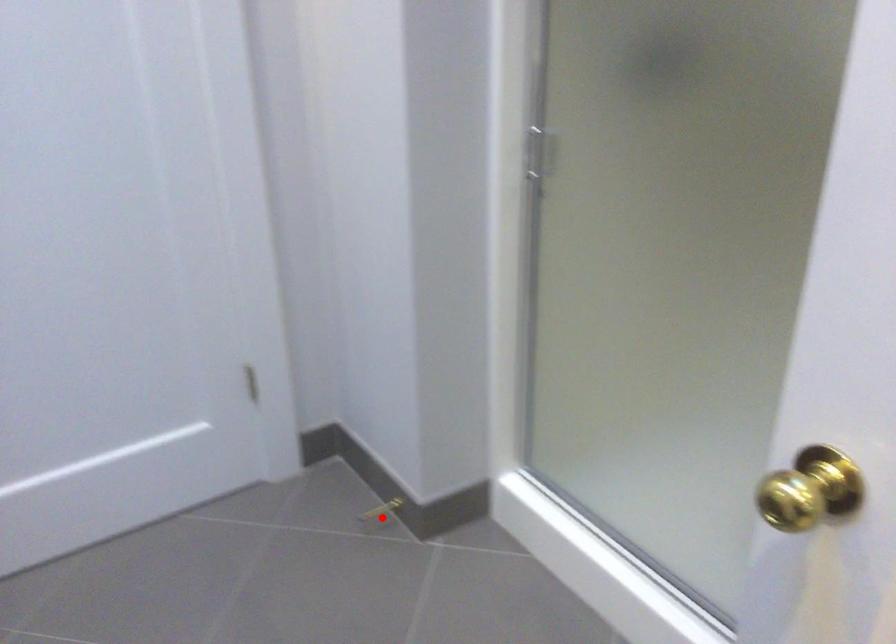
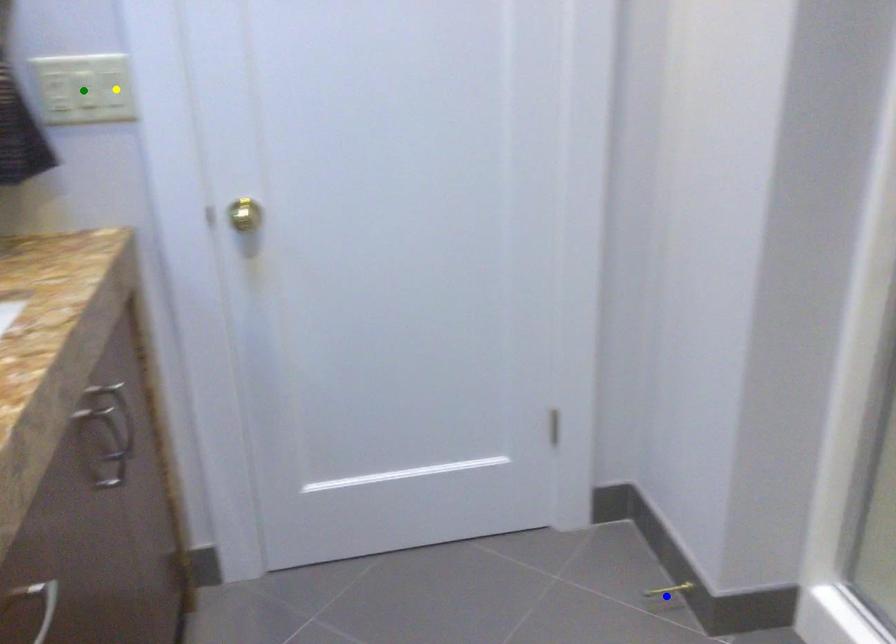
Question: I am providing you with two images of the same scene from different viewpoints. A red point is marked on the first image. You are given multiple points on the second image. Which spot in image 2 lines up with the point in image 1?

Choices:
 (A) green point
 (B) blue point
 (C) yellow point

Answer: (B)